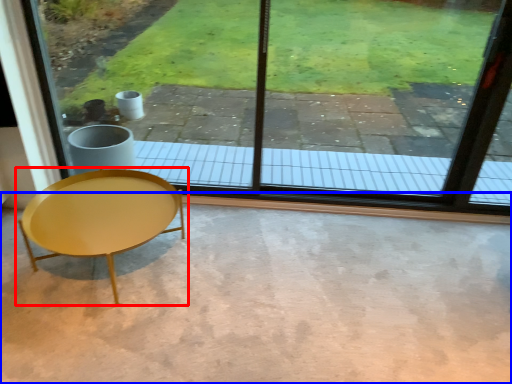
Question: Which object is further to the camera taking this photo, coffee table (highlighted by a red box) or concrete (highlighted by a blue box)?

Choices:
 (A) coffee table
 (B) concrete

Answer: (A)